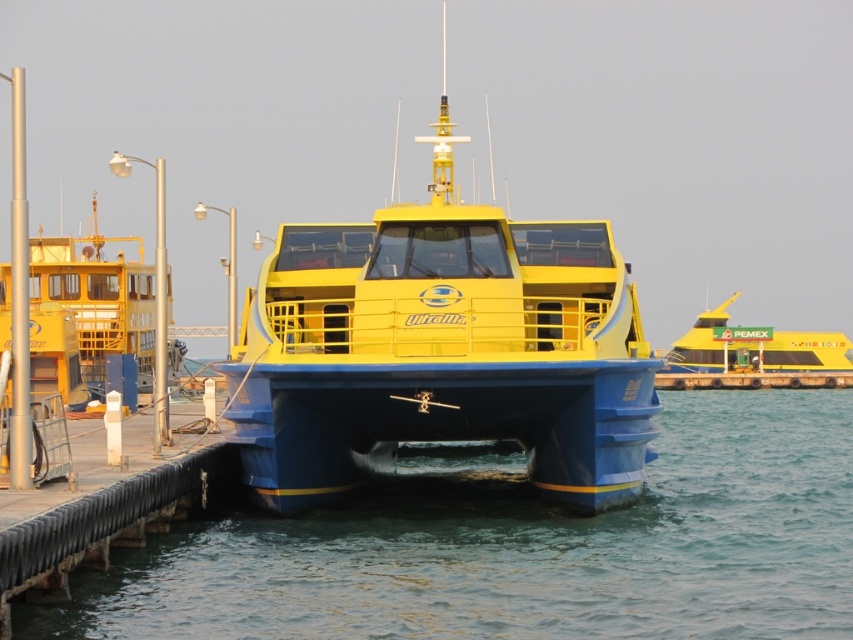
Question: Does blue rubber water at center have a smaller size compared to yellow matte boat at center?

Choices:
 (A) no
 (B) yes

Answer: (B)

Question: Which of these objects is positioned closest to the blue rubber water at center?

Choices:
 (A) yellow matte boat at left
 (B) yellow matte boat at center
 (C) yellow matte boat at upper right

Answer: (B)

Question: Is blue rubber water at center to the right of yellow matte boat at upper right from the viewer's perspective?

Choices:
 (A) yes
 (B) no

Answer: (B)

Question: Considering the real-world distances, which object is farthest from the yellow matte boat at center?

Choices:
 (A) yellow matte boat at left
 (B) blue rubber water at center
 (C) yellow matte boat at upper right

Answer: (C)

Question: Estimate the real-world distances between objects in this image. Which object is closer to the yellow matte boat at left?

Choices:
 (A) yellow matte boat at upper right
 (B) blue rubber water at center
 (C) yellow matte boat at center

Answer: (C)

Question: Can you confirm if blue rubber water at center is wider than yellow matte boat at center?

Choices:
 (A) no
 (B) yes

Answer: (B)